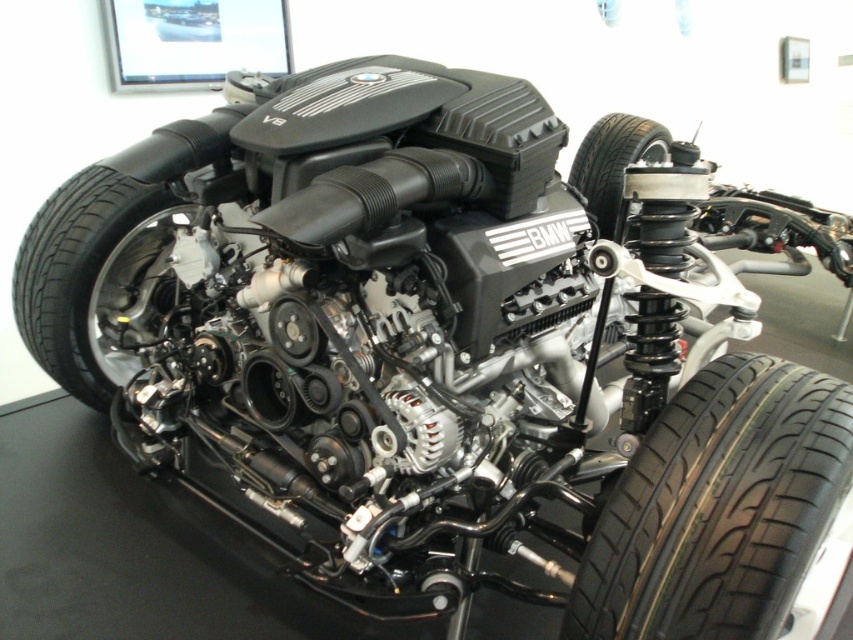
Question: Which object is farther from the camera taking this photo?

Choices:
 (A) black rubber tire at lower left
 (B) black rubber tire at center
 (C) black rubber tire at lower right

Answer: (B)

Question: Is black rubber tire at lower right to the left of black rubber tire at center from the viewer's perspective?

Choices:
 (A) no
 (B) yes

Answer: (B)

Question: Can you confirm if black rubber tire at lower left is smaller than black rubber tire at center?

Choices:
 (A) no
 (B) yes

Answer: (A)

Question: Observing the image, what is the correct spatial positioning of black rubber tire at lower right in reference to black rubber tire at center?

Choices:
 (A) left
 (B) right

Answer: (A)

Question: Which of the following is the farthest from the observer?

Choices:
 (A) (90, 337)
 (B) (604, 589)
 (C) (614, 204)

Answer: (C)

Question: Based on their relative distances, which object is nearer to the black rubber tire at lower left?

Choices:
 (A) black rubber tire at center
 (B) black rubber tire at lower right

Answer: (A)